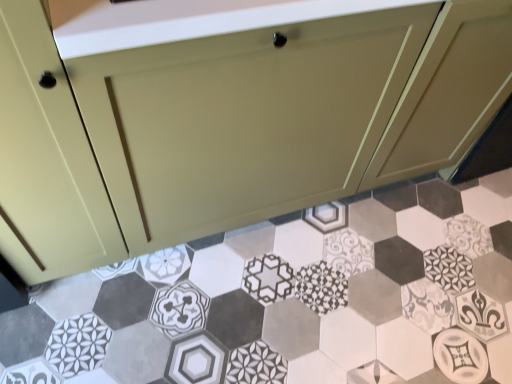
Locate an element on the screen. The image size is (512, 384). empty space that is ontop of patterned ceramic hexagon at center (from a real-world perspective) is located at coordinates (336, 286).